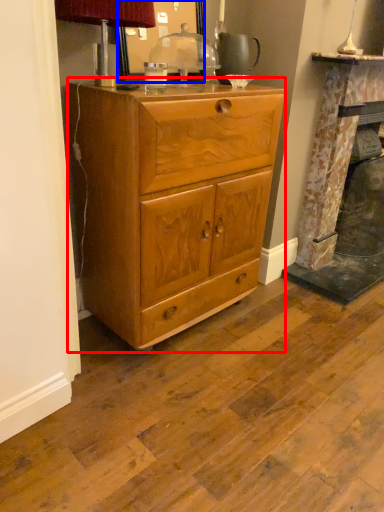
Question: Which point is closer to the camera, chest of drawers (highlighted by a red box) or mirror (highlighted by a blue box)?

Choices:
 (A) chest of drawers
 (B) mirror

Answer: (A)